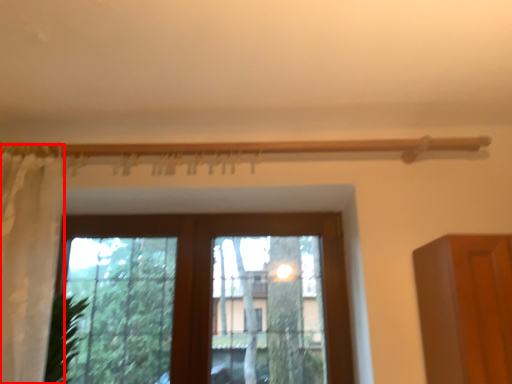
Question: Where is curtain (annotated by the red box) located in relation to window in the image?

Choices:
 (A) right
 (B) left

Answer: (B)